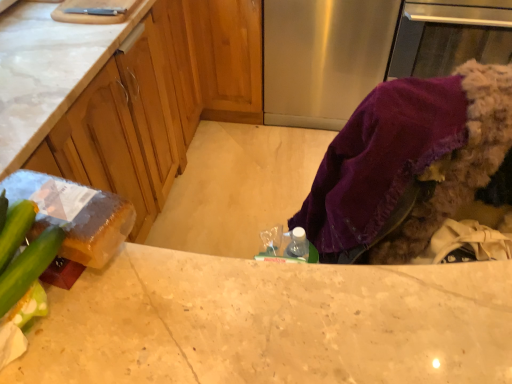
Locate an element on the screen. blank space above marble countertop at center (from a real-world perspective) is located at coordinates (256, 309).